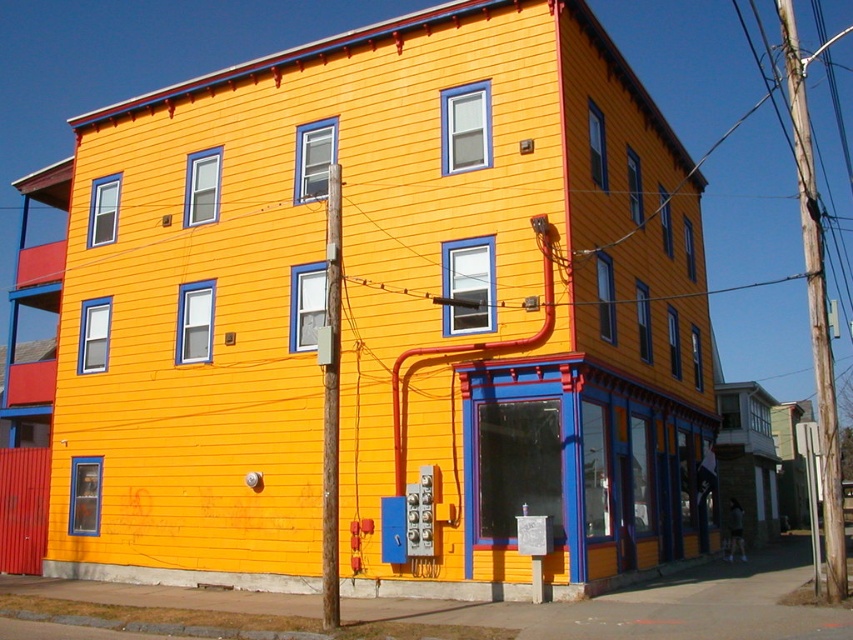
You are a city planner assessing the building facade. You notice two poles on the building exterior. Which pole, the wooden utility pole at right or the smooth wood pole at center, has a larger size?

The wooden utility pole at right is bigger than the smooth wood pole at center.

You are standing at the base of the wooden utility pole at right and want to throw a ball to a friend who is standing at the building entrance. The ball can travel 12 meters. Will it reach your friend?

The wooden utility pole at right and viewer are 11.92 meters apart from each other, so yes, the ball can reach your friend since 11.92 meters is less than 12 meters.

You are standing in front of the yellow building and notice two poles. The wooden utility pole at right and the smooth wood pole at center. Which pole is positioned higher up on the building?

The wooden utility pole at right is positioned higher up on the building than the smooth wood pole at center.